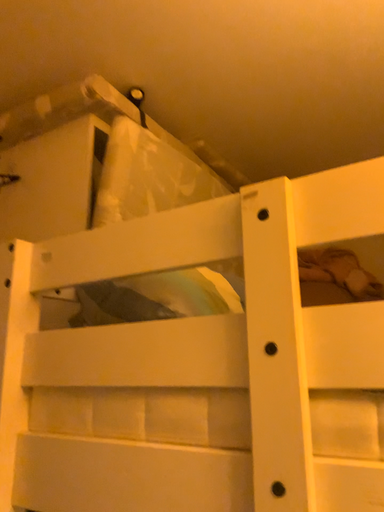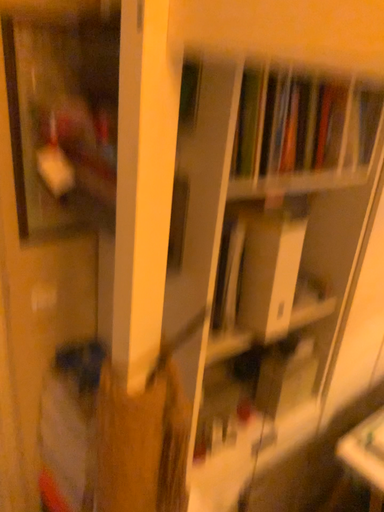
Question: How did the camera likely rotate when shooting the video?

Choices:
 (A) rotated left
 (B) rotated right

Answer: (A)